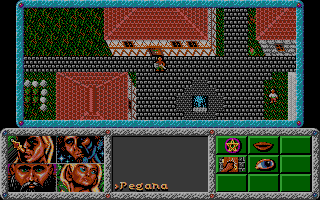
Identify the location of window. The image size is (320, 200). (278, 42), (195, 43), (177, 45), (128, 45).